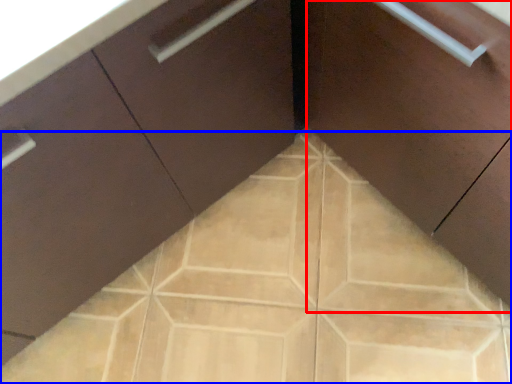
Question: Which point is further to the camera, cabinetry (highlighted by a red box) or ceramic tile (highlighted by a blue box)?

Choices:
 (A) cabinetry
 (B) ceramic tile

Answer: (B)